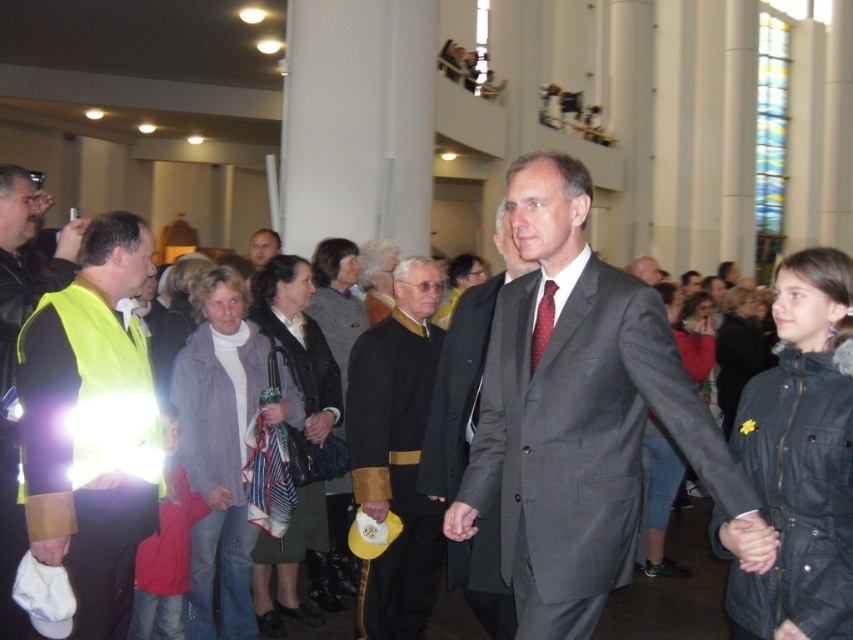
Question: Considering the real-world distances, which object is closest to the black velvet robe at center?

Choices:
 (A) smooth gray suit at center
 (B) gray wool suit at center

Answer: (B)

Question: Which point is farther to the camera?

Choices:
 (A) (442, 509)
 (B) (538, 342)

Answer: (A)

Question: Does black velvet robe at center appear on the left side of black leather jacket at center?

Choices:
 (A) no
 (B) yes

Answer: (A)

Question: Which point appears farthest from the camera in this image?

Choices:
 (A) (479, 317)
 (B) (544, 305)
 (C) (74, 296)

Answer: (A)

Question: Is gray wool suit at center smaller than red dotted tie at center?

Choices:
 (A) yes
 (B) no

Answer: (B)

Question: Is matte gray suit at center positioned at the back of high-visibility yellow vest at left?

Choices:
 (A) yes
 (B) no

Answer: (A)